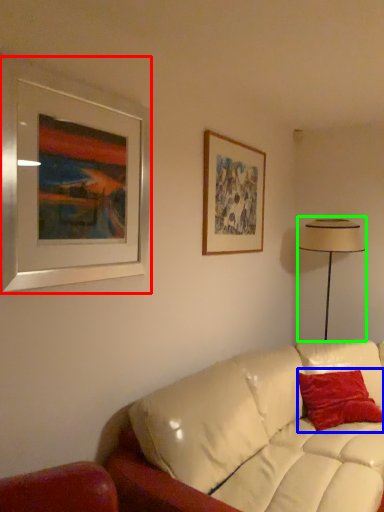
Question: Which object is positioned closest to picture frame (highlighted by a red box)? Select from pillow (highlighted by a blue box) and table lamp (highlighted by a green box).

Choices:
 (A) pillow
 (B) table lamp

Answer: (A)